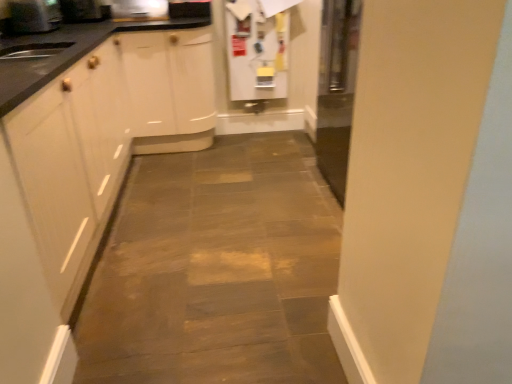
Question: From their relative heights in the image, would you say metallic stainless steel microwave at upper center, which appears as the 3th appliance when viewed from the left, is taller or shorter than white matte refrigerator at upper center, the 1th appliance viewed from the right?

Choices:
 (A) tall
 (B) short

Answer: (B)

Question: Is metallic stainless steel microwave at upper center, which appears as the 3th appliance when viewed from the left, inside or outside of white matte refrigerator at upper center, the 1th appliance viewed from the right?

Choices:
 (A) outside
 (B) inside

Answer: (A)

Question: Which object is positioned farthest from the metallic stainless steel microwave at upper center, the 2th appliance positioned from the right?

Choices:
 (A) white matte refrigerator at upper center, the 1th appliance viewed from the right
 (B) metallic silver toaster at upper left, acting as the fourth appliance starting from the right
 (C) metallic stainless steel microwave at upper left, acting as the 3th appliance starting from the right

Answer: (A)

Question: Which object is the farthest from the metallic stainless steel microwave at upper center, the 2th appliance positioned from the right?

Choices:
 (A) white matte refrigerator at upper center, marked as the 4th appliance in a left-to-right arrangement
 (B) metallic stainless steel microwave at upper left, acting as the 3th appliance starting from the right
 (C) metallic silver toaster at upper left, acting as the fourth appliance starting from the right

Answer: (A)